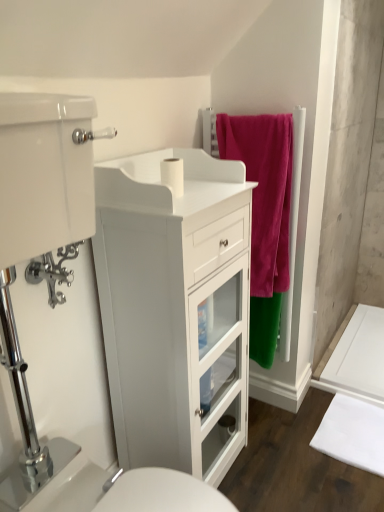
Question: From a real-world perspective, is white matte toilet paper at center above or below white glossy cabinet at left?

Choices:
 (A) below
 (B) above

Answer: (B)

Question: Is white matte toilet paper at center spatially inside white glossy cabinet at left, or outside of it?

Choices:
 (A) outside
 (B) inside

Answer: (B)

Question: Which is farther from the white glossy sink at lower center?

Choices:
 (A) white glossy cabinet at left
 (B) white matte toilet paper at center
 (C) velvet pink towel at upper right
 (D) white fabric bath mat at lower right

Answer: (D)

Question: Which of these objects is positioned farthest from the white matte toilet paper at center?

Choices:
 (A) white glossy sink at lower center
 (B) white glossy cabinet at left
 (C) velvet pink towel at upper right
 (D) white fabric bath mat at lower right

Answer: (D)